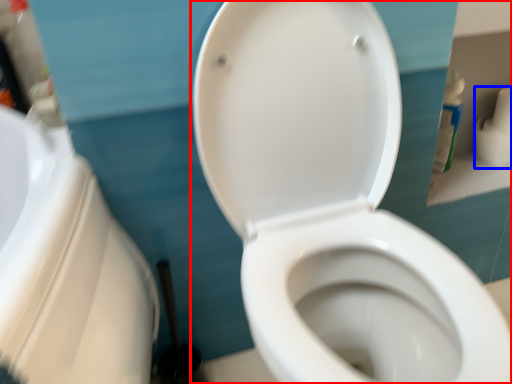
Question: Which point is closer to the camera, toilet (highlighted by a red box) or toilet paper (highlighted by a blue box)?

Choices:
 (A) toilet
 (B) toilet paper

Answer: (A)